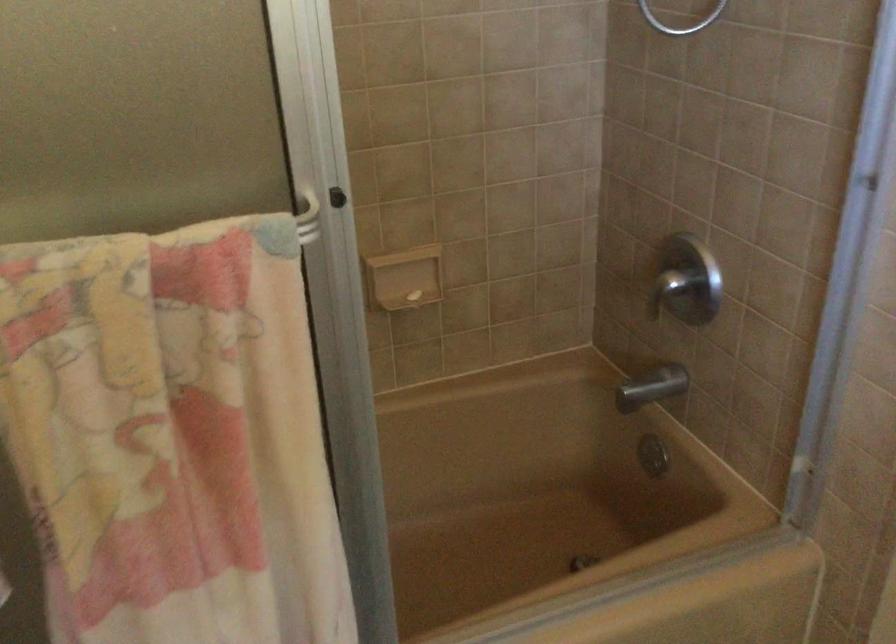
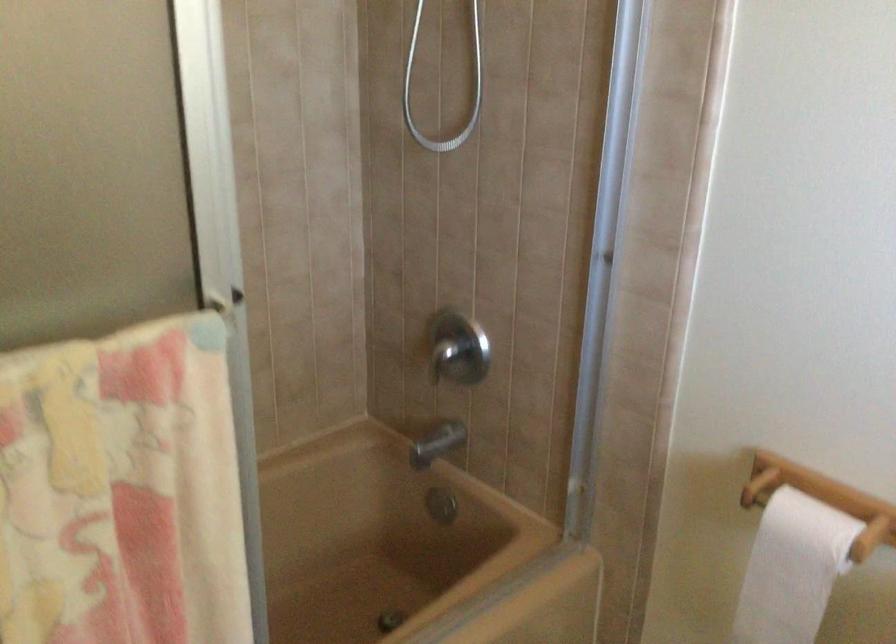
Find the pixel in the second image that matches point (683, 281) in the first image.

(458, 348)